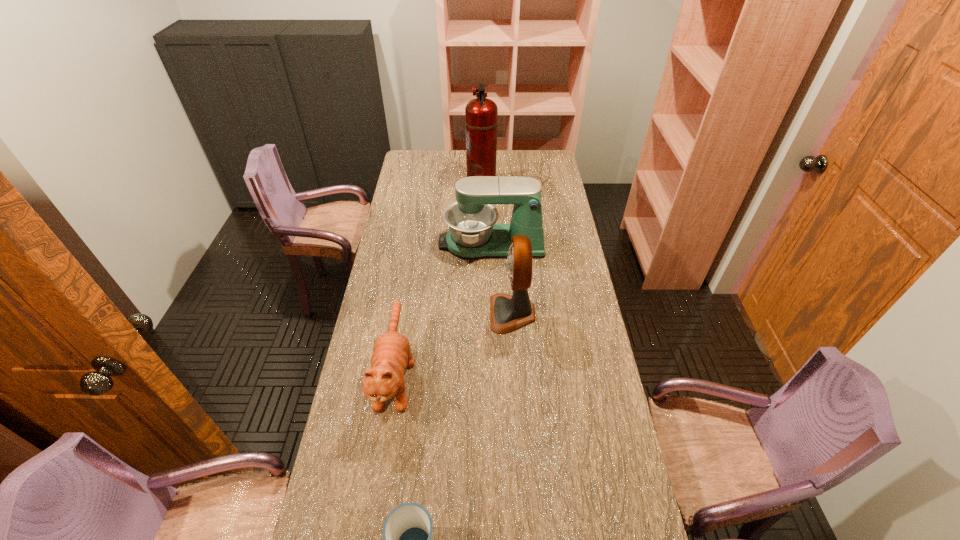
The width and height of the screenshot is (960, 540). In order to click on fire extinguisher in this screenshot , I will do `click(481, 114)`.

Where is `the tallest object`? Image resolution: width=960 pixels, height=540 pixels. the tallest object is located at coordinates (481, 114).

Identify the location of fan. Image resolution: width=960 pixels, height=540 pixels. (508, 313).

At what (x,y) coordinates should I click in order to perform the action: click on the fourth nearest object. Please return your answer as a coordinate pair (x, y). Looking at the image, I should click on pos(473,234).

Find the location of a particular element. This screenshot has width=960, height=540. the third tallest object is located at coordinates (473, 234).

Image resolution: width=960 pixels, height=540 pixels. What are the coordinates of `the second shortest object` in the screenshot? It's located at (391, 356).

Where is `vacant region located 0.260m on the side of the tallest object with the handle and hose`? This screenshot has width=960, height=540. vacant region located 0.260m on the side of the tallest object with the handle and hose is located at coordinates (414, 184).

What are the coordinates of `free region located on the side of the tallest object with the handle and hose` in the screenshot? It's located at (438, 184).

The height and width of the screenshot is (540, 960). What are the coordinates of `vacant space situated on the side of the tallest object with the handle and hose` in the screenshot? It's located at (452, 184).

Where is `vacant space located 0.090m on the front-facing side of the fan`? This screenshot has height=540, width=960. vacant space located 0.090m on the front-facing side of the fan is located at coordinates (466, 313).